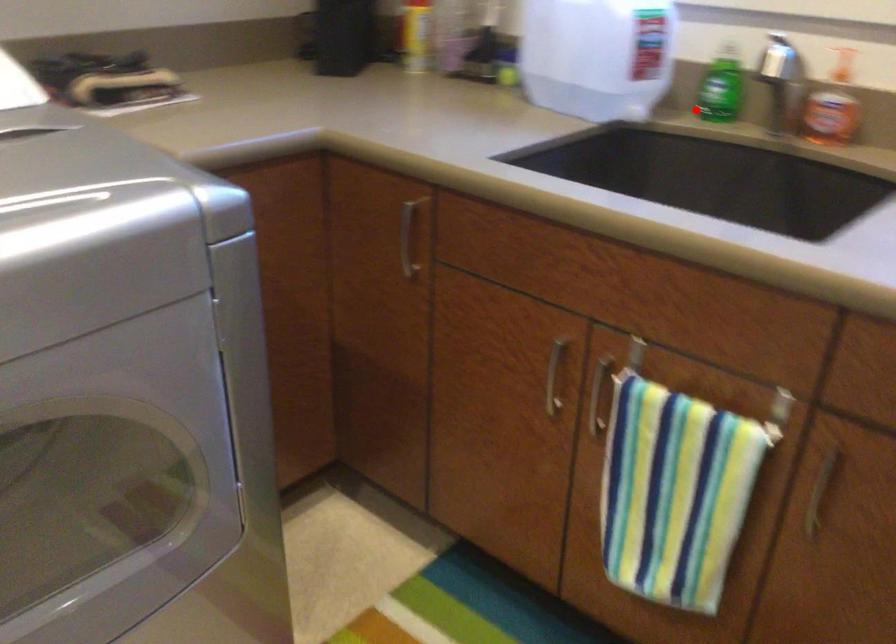
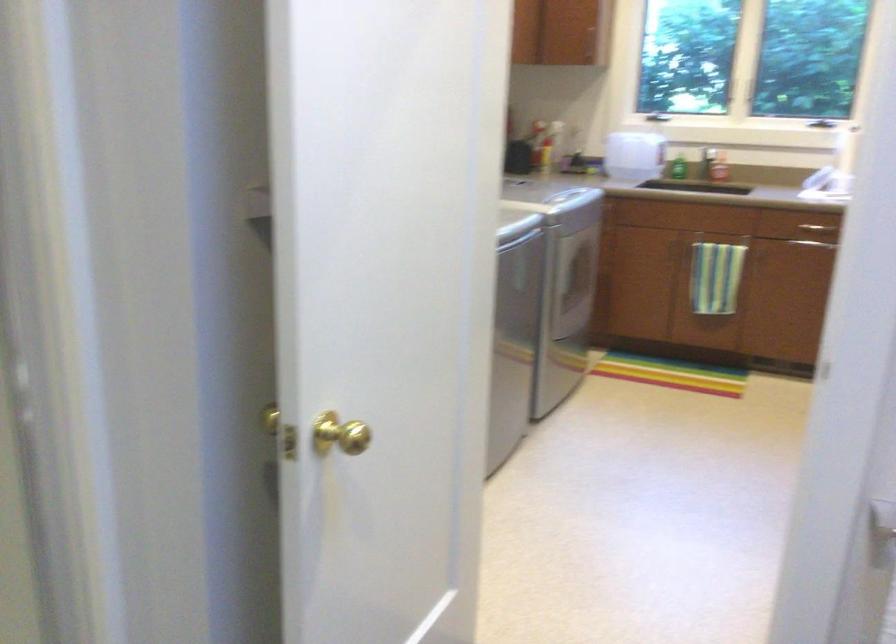
Question: I am providing you with two images of the same scene from different viewpoints. A red point is shown in image1. For the corresponding object point in image2, is it positioned nearer or farther from the camera?

Choices:
 (A) Nearer
 (B) Farther

Answer: (B)